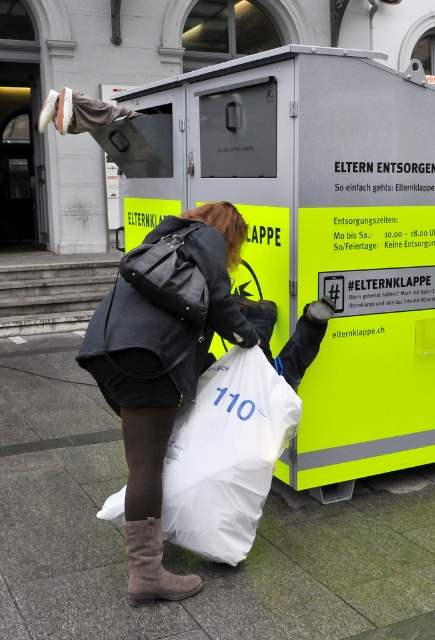
Question: Observing the image, what is the correct spatial positioning of neon yellow plastic container at center in reference to matte black jacket at center?

Choices:
 (A) left
 (B) right

Answer: (B)

Question: Which point is farther to the camera?

Choices:
 (A) (214, 220)
 (B) (264, 516)
 (C) (364, 339)
 (D) (150, 577)

Answer: (C)

Question: Is neon yellow plastic container at center behind brown suede boot at lower left?

Choices:
 (A) no
 (B) yes

Answer: (B)

Question: Among these objects, which one is nearest to the camera?

Choices:
 (A) smooth concrete pavement at lower center
 (B) white plastic bag at lower center

Answer: (A)

Question: Does white plastic bag at lower center have a smaller size compared to brown suede boot at lower left?

Choices:
 (A) no
 (B) yes

Answer: (A)

Question: Which point appears farthest from the camera in this image?

Choices:
 (A) (150, 532)
 (B) (144, 248)
 (C) (217, 481)
 (D) (248, 225)

Answer: (D)